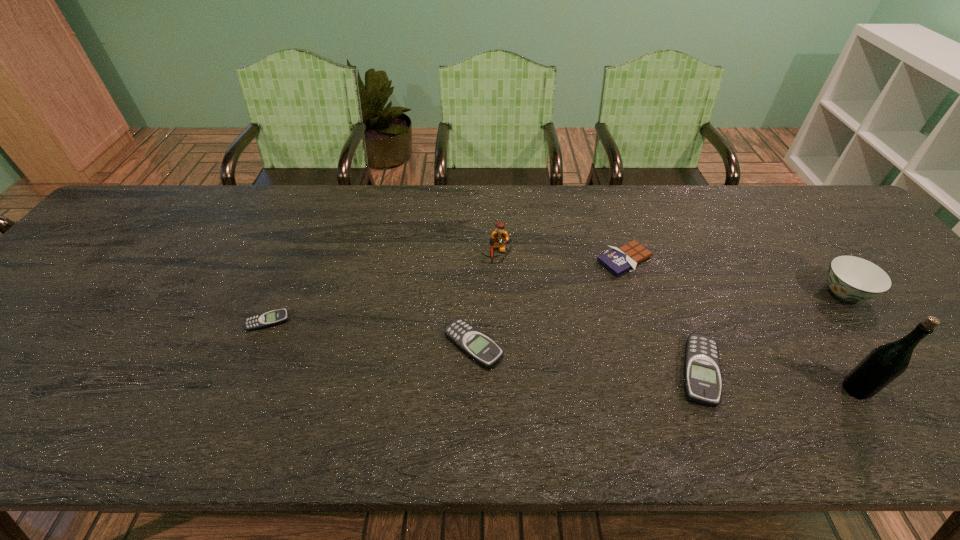
The image size is (960, 540). I want to click on free space between the rightmost beeper and the beer bottle, so click(x=778, y=380).

The height and width of the screenshot is (540, 960). I want to click on free spot between the chocolate bar and the fifth shortest object, so click(x=734, y=276).

This screenshot has width=960, height=540. What are the coordinates of `object that can be found as the fifth closest to the shortest object` in the screenshot? It's located at (881, 366).

Choose which object is the fourth nearest neighbor to the rightmost object. Please provide its 2D coordinates. Your answer should be formatted as a tuple, i.e. [(x, y)], where the tuple contains the x and y coordinates of a point satisfying the conditions above.

[(500, 237)]

Point out which beeper is positioned as the second nearest to the rightmost beeper. Please provide its 2D coordinates. Your answer should be formatted as a tuple, i.e. [(x, y)], where the tuple contains the x and y coordinates of a point satisfying the conditions above.

[(268, 319)]

You are a GUI agent. You are given a task and a screenshot of the screen. Output one action in this format:
    pyautogui.click(x=<x>, y=<y>)
    Task: Click on the beeper that is the third closest to the Lego
    The height and width of the screenshot is (540, 960).
    Given the screenshot: What is the action you would take?
    pyautogui.click(x=268, y=319)

You are a GUI agent. You are given a task and a screenshot of the screen. Output one action in this format:
    pyautogui.click(x=<x>, y=<y>)
    Task: Click on the vacant point that satisfies the following two spatial constraints: 1. holding a crossbow in the hands of the chocolate bar; 2. on the left side of the sixth shortest object
    The height and width of the screenshot is (540, 960).
    Given the screenshot: What is the action you would take?
    pyautogui.click(x=496, y=260)

The image size is (960, 540). In order to click on vacant position in the image that satisfies the following two spatial constraints: 1. on the front side of the rightmost object; 2. on the right side of the chocolate bar in this screenshot , I will do `click(636, 293)`.